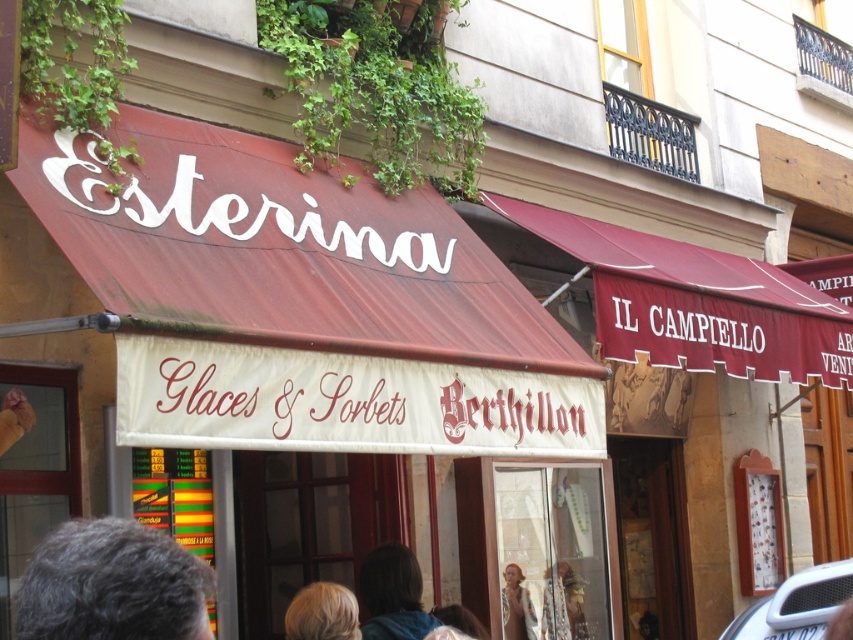
Question: Which point is closer to the camera taking this photo?

Choices:
 (A) (x=844, y=563)
 (B) (x=521, y=612)

Answer: (A)

Question: Which point is farther from the camera taking this photo?

Choices:
 (A) (407, 632)
 (B) (521, 596)
 (C) (799, 634)
 (D) (299, 589)

Answer: (D)

Question: In this image, where is blonde hair at lower center located relative to multicolored fabric at lower center?

Choices:
 (A) right
 (B) left

Answer: (B)

Question: Which point is farther to the camera?

Choices:
 (A) brown hair at center
 (B) white plastic car at lower right

Answer: (A)

Question: Does brown hair at center appear over blonde hair at lower center?

Choices:
 (A) yes
 (B) no

Answer: (B)

Question: Can you confirm if gray hair at lower left is thinner than brown hair at center?

Choices:
 (A) no
 (B) yes

Answer: (A)